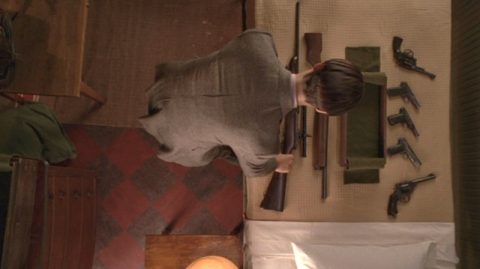
What are the coordinates of `rug` in the screenshot? It's located at (143, 207).